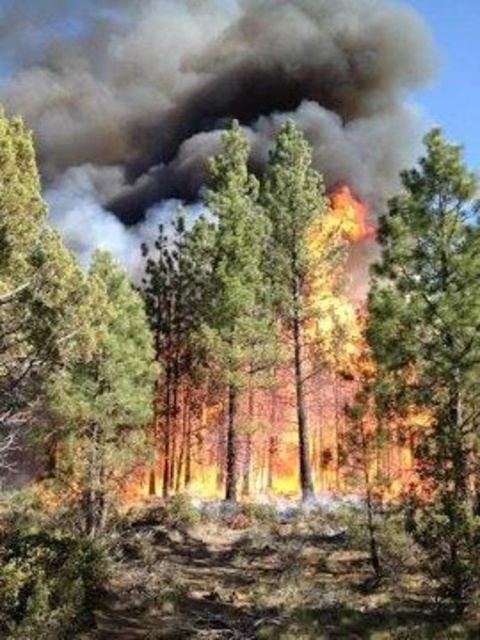
You are a firefighter trying to assess the fire perimeter. You see a charred wood tree trunk at right. Where exactly is it located in the image?

The charred wood tree trunk at right is located at point (434, 348) in the image.

You are a firefighter assessing the forest fire scene. You notice a green matte tree at center and a charred wood tree trunk at center. Which tree is located more to the left?

The green matte tree at center is positioned on the left side of the charred wood tree trunk at center, so it is more to the left.

You are a firefighter trying to assess the situation. You see a green matte tree at center and a charred wood tree trunk at center. Which one is closer to you?

The green matte tree at center is closer to you than the charred wood tree trunk at center.